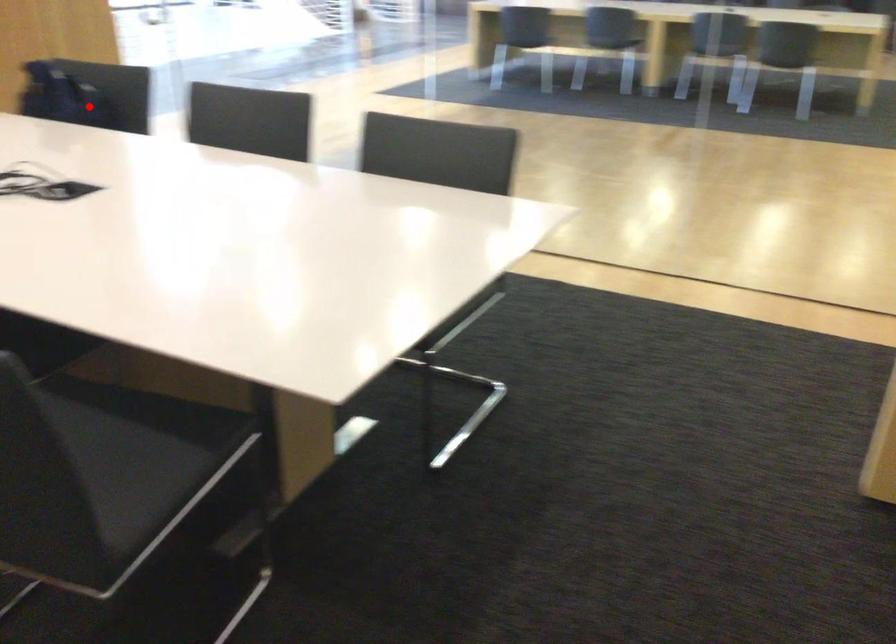
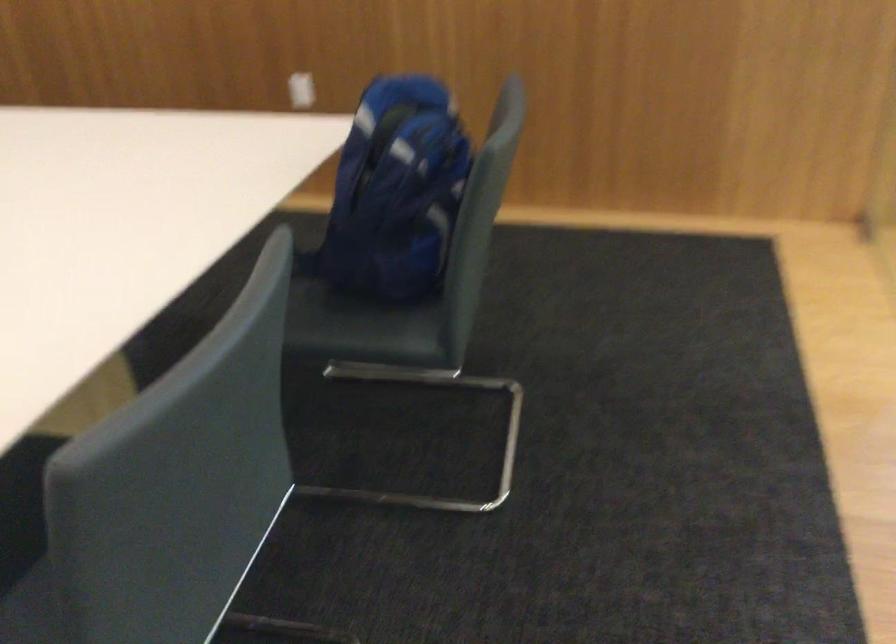
Locate, in the second image, the point that corresponds to the highlighted location in the first image.

(395, 192)